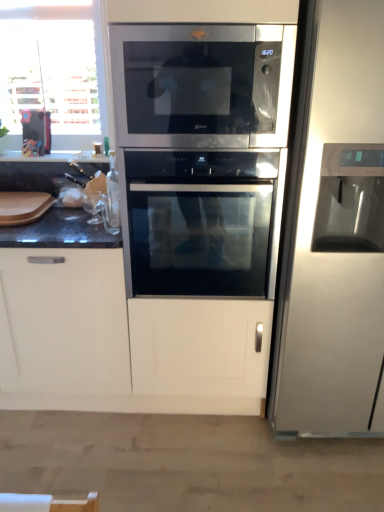
What do you see at coordinates (202, 84) in the screenshot?
I see `stainless steel microwave at center` at bounding box center [202, 84].

What do you see at coordinates (334, 234) in the screenshot? The height and width of the screenshot is (512, 384). I see `satin silver refrigerator at right` at bounding box center [334, 234].

The image size is (384, 512). Identify the location of satin black oven at center. (200, 222).

This screenshot has height=512, width=384. Find the location of `stainless steel microwave at center`. stainless steel microwave at center is located at coordinates (202, 84).

Image resolution: width=384 pixels, height=512 pixels. Identify the location of oven below the stainless steel microwave at center (from the image's perspective). (200, 222).

Does satin black oven at center have a greater height compared to stainless steel microwave at center?

Yes.

Is satin black oven at center placed right next to stainless steel microwave at center?

No, satin black oven at center is not in contact with stainless steel microwave at center.

Is satin black oven at center inside or outside of stainless steel microwave at center?

satin black oven at center is spatially situated outside stainless steel microwave at center.

Measure the distance from stainless steel microwave at center to satin black oven at center.

stainless steel microwave at center and satin black oven at center are 14.22 inches apart.

Are stainless steel microwave at center and satin black oven at center located far from each other?

stainless steel microwave at center is actually quite close to satin black oven at center.

From a real-world perspective, is stainless steel microwave at center above or below satin black oven at center?

stainless steel microwave at center is situated higher than satin black oven at center in the real world.

Is stainless steel microwave at center at the right side of satin black oven at center?

Yes.

Considering the sizes of objects satin black oven at center and satin silver refrigerator at right in the image provided, who is shorter, satin black oven at center or satin silver refrigerator at right?

satin black oven at center is shorter.

Considering the positions of objects satin black oven at center and satin silver refrigerator at right in the image provided, who is in front, satin black oven at center or satin silver refrigerator at right?

satin silver refrigerator at right.

Is satin black oven at center beside satin silver refrigerator at right?

No, satin black oven at center is not making contact with satin silver refrigerator at right.

What are the coordinates of `refrigerator in front of the satin black oven at center` in the screenshot? It's located at (334, 234).

Based on the photo, is satin silver refrigerator at right not close to satin black oven at center?

satin silver refrigerator at right is actually quite close to satin black oven at center.

From a real-world perspective, relative to satin black oven at center, is satin silver refrigerator at right vertically above or below?

In terms of real-world spatial position, satin silver refrigerator at right is above satin black oven at center.

Can you confirm if satin silver refrigerator at right is shorter than satin black oven at center?

In fact, satin silver refrigerator at right may be taller than satin black oven at center.

How far apart are stainless steel microwave at center and satin silver refrigerator at right?

A distance of 16.41 inches exists between stainless steel microwave at center and satin silver refrigerator at right.

How different are the orientations of stainless steel microwave at center and satin silver refrigerator at right in degrees?

There is a 0.108-degree angle between the facing directions of stainless steel microwave at center and satin silver refrigerator at right.

Is stainless steel microwave at center facing towards satin silver refrigerator at right?

No, stainless steel microwave at center does not turn towards satin silver refrigerator at right.

Between point (287, 37) and point (356, 407), which one is positioned behind?

Positioned behind is point (356, 407).

Locate an element on the screen. This screenshot has height=512, width=384. refrigerator that appears below the stainless steel microwave at center (from the image's perspective) is located at coordinates (334, 234).

Looking at their sizes, would you say satin silver refrigerator at right is wider or thinner than stainless steel microwave at center?

Considering their sizes, satin silver refrigerator at right looks broader than stainless steel microwave at center.

Considering the sizes of objects satin silver refrigerator at right and stainless steel microwave at center in the image provided, who is shorter, satin silver refrigerator at right or stainless steel microwave at center?

With less height is stainless steel microwave at center.

From the image's perspective, which is above, satin silver refrigerator at right or stainless steel microwave at center?

stainless steel microwave at center.

In the image, there is a stainless steel microwave at center. Where is `oven below it (from the image's perspective)`? oven below it (from the image's perspective) is located at coordinates (200, 222).

The width and height of the screenshot is (384, 512). Identify the location of oven below the stainless steel microwave at center (from a real-world perspective). (200, 222).

Based on their spatial positions, is satin silver refrigerator at right or stainless steel microwave at center closer to satin black oven at center?

stainless steel microwave at center is closer to satin black oven at center.

Which object lies further to the anchor point stainless steel microwave at center, satin silver refrigerator at right or satin black oven at center?

The object further to stainless steel microwave at center is satin silver refrigerator at right.

Estimate the real-world distances between objects in this image. Which object is closer to stainless steel microwave at center, satin black oven at center or satin silver refrigerator at right?

satin black oven at center is positioned closer to the anchor stainless steel microwave at center.

Looking at the image, which one is located further to satin silver refrigerator at right, stainless steel microwave at center or satin black oven at center?

Among the two, satin black oven at center is located further to satin silver refrigerator at right.

From the picture: Estimate the real-world distances between objects in this image. Which object is closer to satin black oven at center, stainless steel microwave at center or satin silver refrigerator at right?

Based on the image, stainless steel microwave at center appears to be nearer to satin black oven at center.

Considering their positions, is satin black oven at center positioned further to satin silver refrigerator at right than stainless steel microwave at center?

satin black oven at center.

Find the location of a particular element. microwave oven located between satin black oven at center and satin silver refrigerator at right in the left-right direction is located at coordinates (202, 84).